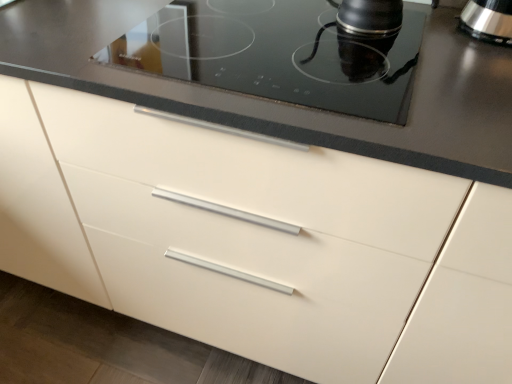
This screenshot has width=512, height=384. What do you see at coordinates (277, 54) in the screenshot?
I see `black glass cooktop at upper center` at bounding box center [277, 54].

Where is `black glass cooktop at upper center`? black glass cooktop at upper center is located at coordinates (277, 54).

Where is `black glass cooktop at upper center`? This screenshot has width=512, height=384. black glass cooktop at upper center is located at coordinates (277, 54).